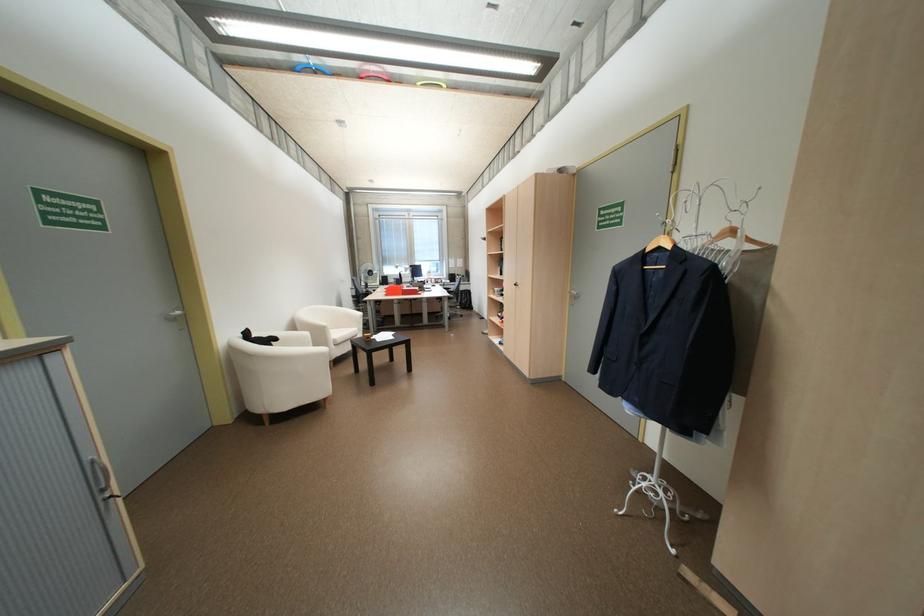
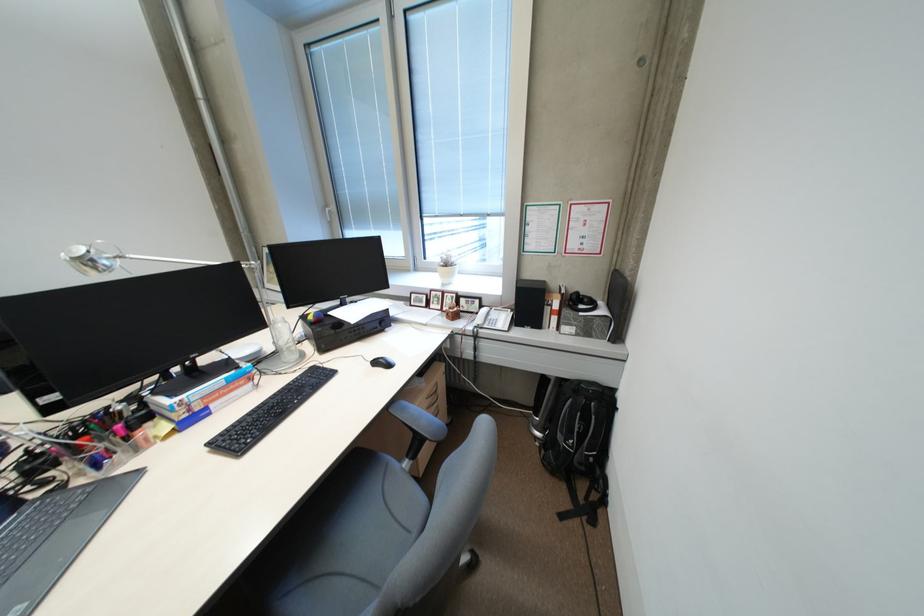
Find the pixel in the second image that matches [463,277] in the first image.

(538, 302)